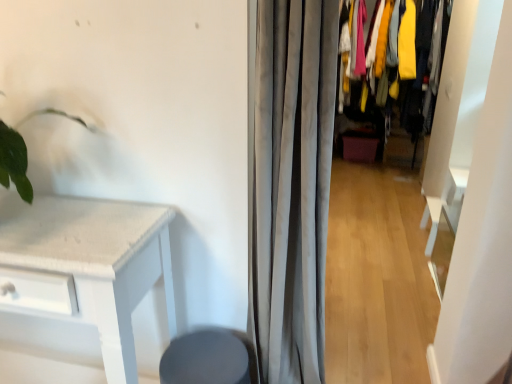
Where is `gray fabric curtain at center`? The width and height of the screenshot is (512, 384). gray fabric curtain at center is located at coordinates (289, 182).

What do you see at coordinates (424, 22) in the screenshot? The height and width of the screenshot is (384, 512). I see `textured fabric closet at center` at bounding box center [424, 22].

Locate an element on the screen. This screenshot has height=384, width=512. gray fabric curtain at center is located at coordinates (289, 182).

Is textured fabric closet at center oriented towards matte gray swivel chair at lower center?

Yes, textured fabric closet at center faces towards matte gray swivel chair at lower center.

From a real-world perspective, is textured fabric closet at center positioned over matte gray swivel chair at lower center based on gravity?

Yes.

This screenshot has width=512, height=384. What are the coordinates of `swivel chair on the left of textured fabric closet at center` in the screenshot? It's located at (209, 358).

Is textured fabric closet at center smaller than matte gray swivel chair at lower center?

Incorrect, textured fabric closet at center is not smaller in size than matte gray swivel chair at lower center.

Based on their sizes in the image, would you say gray fabric curtain at center is bigger or smaller than matte gray swivel chair at lower center?

gray fabric curtain at center is bigger than matte gray swivel chair at lower center.

Looking at this image, is gray fabric curtain at center oriented away from matte gray swivel chair at lower center?

No.

From a real-world perspective, between gray fabric curtain at center and matte gray swivel chair at lower center, who is vertically lower?

matte gray swivel chair at lower center.

From the image's perspective, does gray fabric curtain at center appear lower than matte gray swivel chair at lower center?

No, from the image's perspective, gray fabric curtain at center is not below matte gray swivel chair at lower center.

Considering the positions of objects gray fabric curtain at center and textured fabric closet at center in the image provided, who is more to the left, gray fabric curtain at center or textured fabric closet at center?

gray fabric curtain at center.

Is gray fabric curtain at center turned away from textured fabric closet at center?

Yes, gray fabric curtain at center is positioned with its back facing textured fabric closet at center.

Between gray fabric curtain at center and textured fabric closet at center, which one has more height?

textured fabric closet at center is taller.

Between gray fabric curtain at center and textured fabric closet at center, which one has larger width?

With larger width is textured fabric closet at center.

Which is behind, point (183, 353) or point (322, 359)?

The point (322, 359) is behind.

The image size is (512, 384). In order to click on swivel chair that is on the left side of gray fabric curtain at center in this screenshot , I will do `click(209, 358)`.

Considering the sizes of matte gray swivel chair at lower center and gray fabric curtain at center in the image, is matte gray swivel chair at lower center taller or shorter than gray fabric curtain at center?

In the image, matte gray swivel chair at lower center appears to be shorter than gray fabric curtain at center.

Looking at this image, from a real-world perspective, relative to gray fabric curtain at center, is matte gray swivel chair at lower center vertically above or below?

matte gray swivel chair at lower center is situated lower than gray fabric curtain at center in the real world.

Looking at their sizes, would you say textured fabric closet at center is wider or thinner than gray fabric curtain at center?

Clearly, textured fabric closet at center has more width compared to gray fabric curtain at center.

From a real-world perspective, does textured fabric closet at center sit lower than gray fabric curtain at center?

No.

From the image's perspective, who appears lower, textured fabric closet at center or gray fabric curtain at center?

gray fabric curtain at center.

Relative to gray fabric curtain at center, is textured fabric closet at center in front or behind?

Clearly, textured fabric closet at center is behind gray fabric curtain at center.

Looking at this image, from the image's perspective, which object appears higher, matte gray swivel chair at lower center or textured fabric closet at center?

textured fabric closet at center appears higher in the image.

Which of these two, matte gray swivel chair at lower center or textured fabric closet at center, is wider?

With larger width is textured fabric closet at center.

Can you tell me how much matte gray swivel chair at lower center and textured fabric closet at center differ in facing direction?

The facing directions of matte gray swivel chair at lower center and textured fabric closet at center are 0.368 degrees apart.

Is matte gray swivel chair at lower center to the right of textured fabric closet at center from the viewer's perspective?

No.

At what (x,y) coordinates should I click in order to perform the action: click on closet on the right side of matte gray swivel chair at lower center. Please return your answer as a coordinate pair (x, y). Image resolution: width=512 pixels, height=384 pixels. Looking at the image, I should click on (424, 22).

Where is `curtain that appears above the matte gray swivel chair at lower center (from the image's perspective)`? The image size is (512, 384). curtain that appears above the matte gray swivel chair at lower center (from the image's perspective) is located at coordinates (289, 182).

From the image, which object appears to be nearer to textured fabric closet at center, matte gray swivel chair at lower center or gray fabric curtain at center?

gray fabric curtain at center is closer to textured fabric closet at center.

Based on their spatial positions, is matte gray swivel chair at lower center or textured fabric closet at center closer to gray fabric curtain at center?

matte gray swivel chair at lower center.

From the picture: Based on their spatial positions, is textured fabric closet at center or matte gray swivel chair at lower center closer to gray fabric curtain at center?

The object closer to gray fabric curtain at center is matte gray swivel chair at lower center.

Looking at this image, from the image, which object appears to be farther from matte gray swivel chair at lower center, textured fabric closet at center or gray fabric curtain at center?

Among the two, textured fabric closet at center is located further to matte gray swivel chair at lower center.

From the image, which object appears to be farther from textured fabric closet at center, gray fabric curtain at center or matte gray swivel chair at lower center?

matte gray swivel chair at lower center is positioned further to the anchor textured fabric closet at center.

In the scene shown: Considering their positions, is gray fabric curtain at center positioned closer to matte gray swivel chair at lower center than textured fabric closet at center?

gray fabric curtain at center is positioned closer to the anchor matte gray swivel chair at lower center.

Find the location of `swivel chair between gray fabric curtain at center and textured fabric closet at center along the z-axis`. swivel chair between gray fabric curtain at center and textured fabric closet at center along the z-axis is located at coordinates (209, 358).